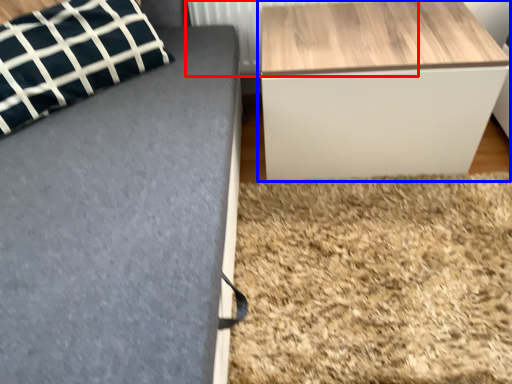
Question: Which object appears farthest to the camera in this image, radiator (highlighted by a red box) or table (highlighted by a blue box)?

Choices:
 (A) radiator
 (B) table

Answer: (A)